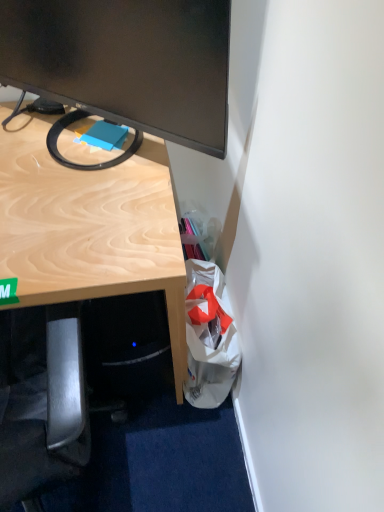
Question: Looking at the image, does white fabric bag at lower right seem bigger or smaller compared to matte black monitor at upper left?

Choices:
 (A) big
 (B) small

Answer: (B)

Question: From a real-world perspective, relative to matte black monitor at upper left, is white fabric bag at lower right vertically above or below?

Choices:
 (A) below
 (B) above

Answer: (A)

Question: Based on their positions, is white fabric bag at lower right located to the left or right of matte black monitor at upper left?

Choices:
 (A) left
 (B) right

Answer: (B)

Question: Based on their sizes in the image, would you say matte black monitor at upper left is bigger or smaller than white fabric bag at lower right?

Choices:
 (A) big
 (B) small

Answer: (A)

Question: From a real-world perspective, relative to white fabric bag at lower right, is matte black monitor at upper left vertically above or below?

Choices:
 (A) below
 (B) above

Answer: (B)

Question: Looking at their shapes, would you say matte black monitor at upper left is wider or thinner than white fabric bag at lower right?

Choices:
 (A) wide
 (B) thin

Answer: (B)

Question: Based on their positions, is matte black monitor at upper left located to the left or right of white fabric bag at lower right?

Choices:
 (A) right
 (B) left

Answer: (B)